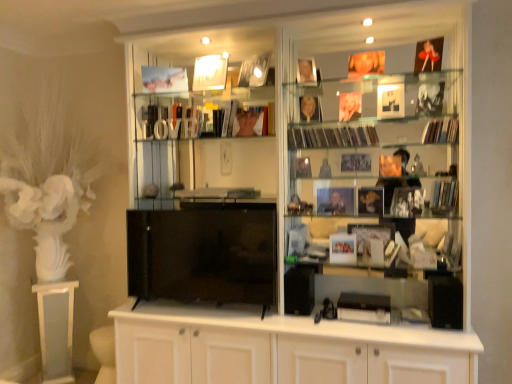
The image size is (512, 384). What do you see at coordinates (310, 109) in the screenshot? I see `matte gold photo frame at upper center, the 1th book when ordered from top to bottom` at bounding box center [310, 109].

Locate an element on the screen. matte paper magazine at center, which appears as the 3th magazine when ordered from the bottom is located at coordinates [x=356, y=162].

The image size is (512, 384). Describe the element at coordinates (364, 307) in the screenshot. I see `black matte magazine at center, which ranks as the fifth magazine in top-to-bottom order` at that location.

This screenshot has height=384, width=512. I want to click on black matte magazine at center, placed as the 1th magazine when sorted from bottom to top, so click(x=364, y=307).

Locate an element on the screen. This screenshot has width=512, height=384. matte white photo frame at center, the 1th book positioned from the right is located at coordinates (343, 249).

Describe the element at coordinates (343, 249) in the screenshot. I see `matte white photo frame at center, the 1th book positioned from the right` at that location.

Image resolution: width=512 pixels, height=384 pixels. Describe the element at coordinates (441, 131) in the screenshot. I see `matte paper magazine at upper right, which is the 1th magazine in top-to-bottom order` at that location.

Find the location of a particular element. This screenshot has height=384, width=512. white glossy cupboard at center is located at coordinates (362, 183).

Locate an element on the screen. The height and width of the screenshot is (384, 512). shiny plastic magazines at center right, which is counted as the fourth magazine, starting from the bottom is located at coordinates (332, 137).

Can you see shiny plastic magazines at center right, arranged as the 2th magazine when viewed from the top, touching matte black book at right, which appears as the 4th magazine when viewed from the top?

No, shiny plastic magazines at center right, arranged as the 2th magazine when viewed from the top, is not making contact with matte black book at right, which appears as the 4th magazine when viewed from the top.

From a real-world perspective, who is located lower, shiny plastic magazines at center right, arranged as the 2th magazine when viewed from the top, or matte black book at right, which appears as the 4th magazine when viewed from the top?

matte black book at right, which appears as the 4th magazine when viewed from the top, is physically lower.

Is white glossy pedestal at left to the right of black matte magazine at center, placed as the 1th magazine when sorted from bottom to top, from the viewer's perspective?

In fact, white glossy pedestal at left is to the left of black matte magazine at center, placed as the 1th magazine when sorted from bottom to top.

Can you confirm if white glossy pedestal at left is thinner than black matte magazine at center, placed as the 1th magazine when sorted from bottom to top?

No.

Is white glossy pedestal at left inside the boundaries of black matte magazine at center, which ranks as the fifth magazine in top-to-bottom order, or outside?

The correct answer is: outside.

Is white glossy pedestal at left looking in the opposite direction of black matte magazine at center, placed as the 1th magazine when sorted from bottom to top?

No, white glossy pedestal at left is not facing away from black matte magazine at center, placed as the 1th magazine when sorted from bottom to top.

Could you tell me if matte gold photo frame at upper center, the second book viewed from the right, is turned towards matte black book at right, the second magazine positioned from the bottom?

No, matte gold photo frame at upper center, the second book viewed from the right, is not oriented towards matte black book at right, the second magazine positioned from the bottom.

Which is more to the left, matte gold photo frame at upper center, the 2th book in the bottom-to-top sequence, or matte black book at right, the second magazine positioned from the bottom?

Positioned to the left is matte gold photo frame at upper center, the 2th book in the bottom-to-top sequence.

From the image's perspective, does matte gold photo frame at upper center, arranged as the first book when viewed from the left, appear lower than matte black book at right, which appears as the 4th magazine when viewed from the top?

Incorrect, from the image's perspective, matte gold photo frame at upper center, arranged as the first book when viewed from the left, is higher than matte black book at right, which appears as the 4th magazine when viewed from the top.

Is matte gold photo frame at upper center, the 2th book in the bottom-to-top sequence, surrounding matte black book at right, which appears as the 4th magazine when viewed from the top?

No, matte black book at right, which appears as the 4th magazine when viewed from the top, is not surrounded by matte gold photo frame at upper center, the 2th book in the bottom-to-top sequence.

From a real-world perspective, which object stands above the other?

From a 3D spatial view, shiny plastic magazines at center right, which is counted as the fourth magazine, starting from the bottom, is above.

Identify the location of table on the left of shiny plastic magazines at center right, which is counted as the fourth magazine, starting from the bottom. Image resolution: width=512 pixels, height=384 pixels. (56, 329).

In the scene shown: Can you confirm if shiny plastic magazines at center right, arranged as the 2th magazine when viewed from the top, is smaller than white glossy pedestal at left?

Yes.

How far apart are matte paper magazine at center, the third magazine positioned from the top, and matte white photo frame at center, the first book when ordered from bottom to top?

A distance of 18.81 inches exists between matte paper magazine at center, the third magazine positioned from the top, and matte white photo frame at center, the first book when ordered from bottom to top.

Which is correct: matte paper magazine at center, the third magazine positioned from the top, is inside matte white photo frame at center, the 1th book positioned from the right, or outside of it?

matte paper magazine at center, the third magazine positioned from the top, lies outside matte white photo frame at center, the 1th book positioned from the right.

Is matte paper magazine at center, which appears as the 3th magazine when ordered from the bottom, turned away from matte white photo frame at center, which ranks as the 1th book in front-to-back order?

No, matte paper magazine at center, which appears as the 3th magazine when ordered from the bottom, is not facing away from matte white photo frame at center, which ranks as the 1th book in front-to-back order.

From the image's perspective, is matte paper magazine at center, the third magazine positioned from the top, beneath matte white photo frame at center, the second book viewed from the back?

Actually, matte paper magazine at center, the third magazine positioned from the top, appears above matte white photo frame at center, the second book viewed from the back, in the image.

From a real-world perspective, is shiny plastic magazines at center right, which is counted as the fourth magazine, starting from the bottom, over black matte magazine at center, placed as the 1th magazine when sorted from bottom to top?

Yes, from a real-world perspective, shiny plastic magazines at center right, which is counted as the fourth magazine, starting from the bottom, is over black matte magazine at center, placed as the 1th magazine when sorted from bottom to top

Who is smaller, shiny plastic magazines at center right, arranged as the 2th magazine when viewed from the top, or black matte magazine at center, placed as the 1th magazine when sorted from bottom to top?

Smaller between the two is black matte magazine at center, placed as the 1th magazine when sorted from bottom to top.

In the scene shown: From the image's perspective, which one is positioned lower, shiny plastic magazines at center right, which is counted as the fourth magazine, starting from the bottom, or black matte magazine at center, placed as the 1th magazine when sorted from bottom to top?

black matte magazine at center, placed as the 1th magazine when sorted from bottom to top.

Is black matte magazine at center, which ranks as the fifth magazine in top-to-bottom order, at the back of shiny plastic magazines at center right, which is counted as the fourth magazine, starting from the bottom?

No, black matte magazine at center, which ranks as the fifth magazine in top-to-bottom order, is not at the back of shiny plastic magazines at center right, which is counted as the fourth magazine, starting from the bottom.

Is point (41, 298) behind point (318, 104)?

That is True.

From the image's perspective, is white glossy pedestal at left positioned above or below matte gold photo frame at upper center, which is counted as the 1th book, starting from the back?

white glossy pedestal at left is situated lower than matte gold photo frame at upper center, which is counted as the 1th book, starting from the back, in the image.

Is white glossy pedestal at left oriented away from matte gold photo frame at upper center, arranged as the second book when viewed from the front?

white glossy pedestal at left is not turned away from matte gold photo frame at upper center, arranged as the second book when viewed from the front.

Locate an element on the screen. the 3rd magazine below the shiny plastic magazines at center right, which is counted as the fourth magazine, starting from the bottom (from a real-world perspective) is located at coordinates (444, 197).

From the image's perspective, count 1st magazines upward from the white glossy pedestal at left and point to it. Please provide its 2D coordinates.

[(364, 307)]

When comparing their distances from shiny plastic magazines at center right, arranged as the 2th magazine when viewed from the top, does black matte magazine at center, which ranks as the fifth magazine in top-to-bottom order, or matte black book at right, the second magazine positioned from the bottom, seem further?

black matte magazine at center, which ranks as the fifth magazine in top-to-bottom order, is positioned further to the anchor shiny plastic magazines at center right, arranged as the 2th magazine when viewed from the top.

From the image, which object appears to be nearer to shiny plastic magazines at center right, arranged as the 2th magazine when viewed from the top, matte gold photo frame at upper center, the second book viewed from the right, or white glossy pedestal at left?

matte gold photo frame at upper center, the second book viewed from the right, is closer to shiny plastic magazines at center right, arranged as the 2th magazine when viewed from the top.

Considering their positions, is matte paper magazine at center, the third magazine positioned from the top, positioned further to matte white photo frame at center, the 1th book positioned from the right, than matte paper magazine at upper right, the fifth magazine positioned from the bottom?

matte paper magazine at upper right, the fifth magazine positioned from the bottom.

Looking at the image, which one is located closer to matte paper magazine at center, which appears as the 3th magazine when ordered from the bottom, black matte magazine at center, placed as the 1th magazine when sorted from bottom to top, or matte black book at right, which appears as the 4th magazine when viewed from the top?

Based on the image, matte black book at right, which appears as the 4th magazine when viewed from the top, appears to be nearer to matte paper magazine at center, which appears as the 3th magazine when ordered from the bottom.

Based on the photo, looking at the image, which one is located closer to matte white photo frame at center, the 2th book from the top, matte paper magazine at center, the third magazine positioned from the top, or matte gold photo frame at upper center, arranged as the second book when viewed from the front?

Among the two, matte paper magazine at center, the third magazine positioned from the top, is located nearer to matte white photo frame at center, the 2th book from the top.

Looking at the image, which one is located further to matte gold photo frame at upper center, the 1th book when ordered from top to bottom, black glossy tv at center or black matte magazine at center, which ranks as the fifth magazine in top-to-bottom order?

black matte magazine at center, which ranks as the fifth magazine in top-to-bottom order, is positioned further to the anchor matte gold photo frame at upper center, the 1th book when ordered from top to bottom.

Looking at the image, which one is located further to white glossy pedestal at left, white glossy cupboard at center or matte paper magazine at upper right, which is the 1th magazine in top-to-bottom order?

The object further to white glossy pedestal at left is matte paper magazine at upper right, which is the 1th magazine in top-to-bottom order.

From the image, which object appears to be nearer to black matte magazine at center, which ranks as the fifth magazine in top-to-bottom order, matte gold photo frame at upper center, arranged as the first book when viewed from the left, or black glossy tv at center?

Among the two, black glossy tv at center is located nearer to black matte magazine at center, which ranks as the fifth magazine in top-to-bottom order.

The image size is (512, 384). In order to click on cupboard situated between white glossy pedestal at left and shiny plastic magazines at center right, arranged as the 2th magazine when viewed from the top, from left to right in this screenshot , I will do click(362, 183).

Image resolution: width=512 pixels, height=384 pixels. I want to click on wide between white glossy pedestal at left and matte paper magazine at upper right, the fifth magazine positioned from the bottom, from left to right, so click(204, 253).

Identify the location of cupboard located between black glossy tv at center and shiny plastic magazines at center right, which is counted as the fourth magazine, starting from the bottom, in the left-right direction. (362, 183).

This screenshot has height=384, width=512. I want to click on cupboard between matte gold photo frame at upper center, the 2th book in the bottom-to-top sequence, and black matte magazine at center, which ranks as the fifth magazine in top-to-bottom order, vertically, so click(x=362, y=183).